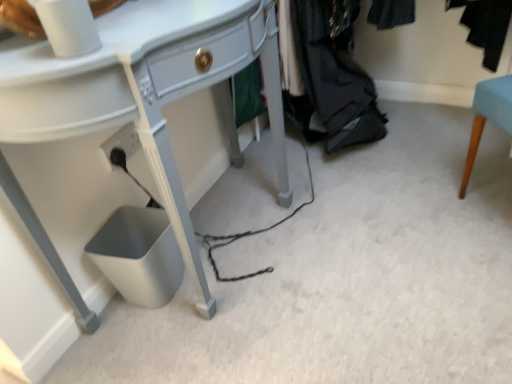
Find the location of a particular element. The height and width of the screenshot is (384, 512). dark gray fabric at lower right is located at coordinates (332, 76).

What do you see at coordinates (332, 76) in the screenshot? Image resolution: width=512 pixels, height=384 pixels. I see `dark gray fabric at lower right` at bounding box center [332, 76].

What is the approximate height of dark gray fabric at lower right?

16.87 inches.

This screenshot has width=512, height=384. What are the coordinates of `matte white desk at center` in the screenshot? It's located at (110, 148).

This screenshot has width=512, height=384. What do you see at coordinates (110, 148) in the screenshot?
I see `matte white desk at center` at bounding box center [110, 148].

Identify the location of dark gray fabric at lower right. The height and width of the screenshot is (384, 512). (332, 76).

Is matte white desk at center at the right side of dark gray fabric at lower right?

Incorrect, matte white desk at center is not on the right side of dark gray fabric at lower right.

Who is more distant, matte white desk at center or dark gray fabric at lower right?

dark gray fabric at lower right is behind.

Which is less distant, (175,175) or (350,121)?

The point (175,175) is closer.

From the image's perspective, which one is positioned lower, matte white desk at center or dark gray fabric at lower right?

matte white desk at center, from the image's perspective.

In the scene shown: From a real-world perspective, between matte white desk at center and dark gray fabric at lower right, who is vertically lower?

dark gray fabric at lower right.

In terms of width, does matte white desk at center look wider or thinner when compared to dark gray fabric at lower right?

Clearly, matte white desk at center has less width compared to dark gray fabric at lower right.

Can you confirm if matte white desk at center is taller than dark gray fabric at lower right?

Indeed, matte white desk at center has a greater height compared to dark gray fabric at lower right.

From the picture: Which of these two, matte white desk at center or dark gray fabric at lower right, is bigger?

Bigger between the two is matte white desk at center.

Would you say matte white desk at center contains dark gray fabric at lower right?

Definitely not — dark gray fabric at lower right is not inside matte white desk at center.

Consider the image. Is matte white desk at center not close to dark gray fabric at lower right?

No, matte white desk at center is not far from dark gray fabric at lower right.

Is matte white desk at center oriented away from dark gray fabric at lower right?

matte white desk at center is not turned away from dark gray fabric at lower right.

Based on the photo, how different are the orientations of matte white desk at center and dark gray fabric at lower right in degrees?

There is a 95-degree angle between the facing directions of matte white desk at center and dark gray fabric at lower right.

At what (x,y) coordinates should I click in order to perform the action: click on desk in front of the dark gray fabric at lower right. Please return your answer as a coordinate pair (x, y). This screenshot has height=384, width=512. Looking at the image, I should click on (110, 148).

Looking at this image, considering the relative positions of dark gray fabric at lower right and matte white desk at center in the image provided, is dark gray fabric at lower right to the right of matte white desk at center from the viewer's perspective?

Correct, you'll find dark gray fabric at lower right to the right of matte white desk at center.

Is dark gray fabric at lower right positioned behind matte white desk at center?

Yes, it is behind matte white desk at center.

Which point is more distant from viewer, (315, 37) or (96, 193)?

The point (315, 37) is behind.

From the image's perspective, is dark gray fabric at lower right on top of matte white desk at center?

Yes.

From a real-world perspective, which is physically below, dark gray fabric at lower right or matte white desk at center?

dark gray fabric at lower right is physically lower.

Based on the photo, is dark gray fabric at lower right wider or thinner than matte white desk at center?

dark gray fabric at lower right is wider than matte white desk at center.

From their relative heights in the image, would you say dark gray fabric at lower right is taller or shorter than matte white desk at center?

dark gray fabric at lower right is shorter than matte white desk at center.

Between dark gray fabric at lower right and matte white desk at center, which one has larger size?

Bigger between the two is matte white desk at center.

Would you say dark gray fabric at lower right is outside matte white desk at center?

Absolutely, dark gray fabric at lower right is external to matte white desk at center.

Are dark gray fabric at lower right and matte white desk at center beside each other?

No, dark gray fabric at lower right is not with matte white desk at center.

Is dark gray fabric at lower right turned away from matte white desk at center?

No, dark gray fabric at lower right's orientation is not away from matte white desk at center.

How many degrees apart are the facing directions of dark gray fabric at lower right and matte white desk at center?

95 degrees separate the facing orientations of dark gray fabric at lower right and matte white desk at center.

Locate an element on the screen. This screenshot has height=384, width=512. desk located above the dark gray fabric at lower right (from a real-world perspective) is located at coordinates (110, 148).

The height and width of the screenshot is (384, 512). I want to click on desk located on the left of dark gray fabric at lower right, so click(x=110, y=148).

The image size is (512, 384). I want to click on desk above the dark gray fabric at lower right (from a real-world perspective), so click(x=110, y=148).